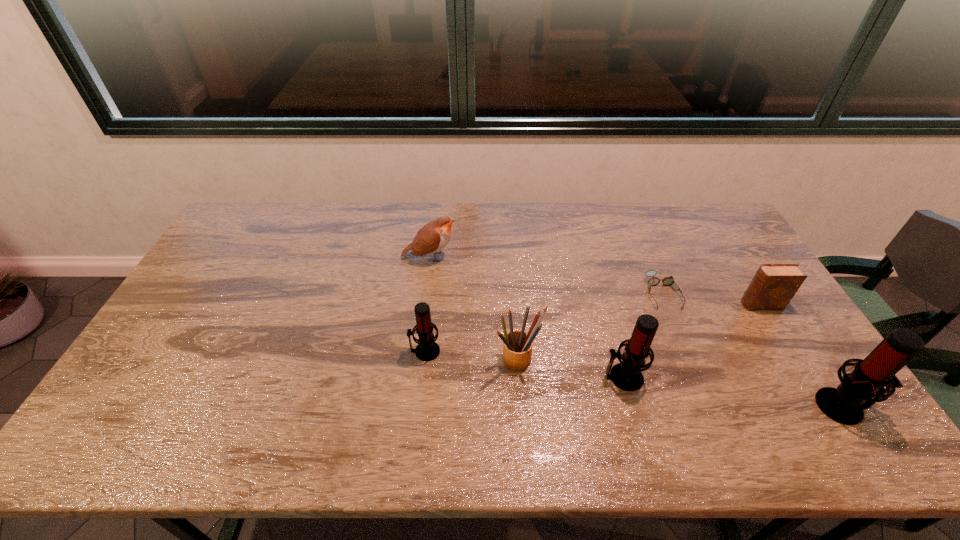
What are the coordinates of `microphone positioned at the right edge` in the screenshot? It's located at (863, 387).

You are a GUI agent. You are given a task and a screenshot of the screen. Output one action in this format:
    pyautogui.click(x=<x>, y=<y>)
    Task: Click on the diary that is positioned at the right edge
    The height and width of the screenshot is (540, 960).
    Given the screenshot: What is the action you would take?
    pyautogui.click(x=774, y=285)

Locate an element on the screen. The image size is (960, 540). object at the near right corner is located at coordinates (863, 387).

In the image, there is a desktop. Identify the location of vacant space at the far edge. The height and width of the screenshot is (540, 960). (606, 202).

Locate an element on the screen. The width and height of the screenshot is (960, 540). blank area at the near edge is located at coordinates (299, 399).

The width and height of the screenshot is (960, 540). Find the location of `free space at the left edge of the desktop`. free space at the left edge of the desktop is located at coordinates (205, 306).

You are a GUI agent. You are given a task and a screenshot of the screen. Output one action in this format:
    pyautogui.click(x=<x>, y=<y>)
    Task: Click on the blank area at the far left corner
    
    Given the screenshot: What is the action you would take?
    pyautogui.click(x=268, y=224)

This screenshot has width=960, height=540. I want to click on free space at the near left corner of the desktop, so click(x=180, y=388).

This screenshot has height=540, width=960. Find the location of `free location at the far right corner`. free location at the far right corner is located at coordinates (728, 233).

Identify the location of free space that is in between the shortest object and the pencil box. The image size is (960, 540). (590, 326).